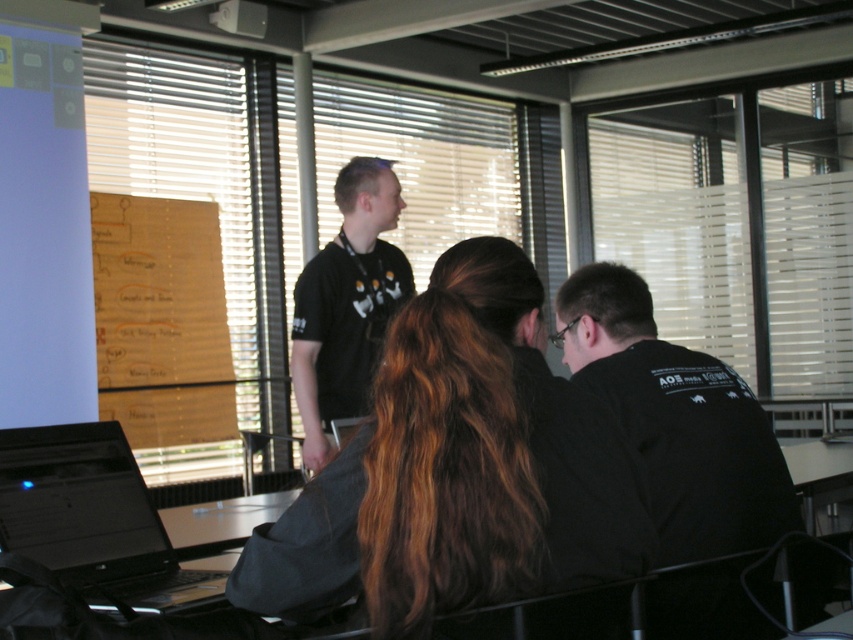
Describe the element at coordinates (347, 304) in the screenshot. I see `black matte shirt at center` at that location.

Is black matte shirt at center behind white plastic projector at upper center?

That is False.

Who is more distant from viewer, (326,397) or (233,12)?

Positioned behind is point (233,12).

The height and width of the screenshot is (640, 853). Find the location of `black matte shirt at center`. black matte shirt at center is located at coordinates (347, 304).

Which is behind, point (775, 593) or point (352, 172)?

Positioned behind is point (352, 172).

Which of these two, black matte shirt at right or black matte shirt at center, stands taller?

black matte shirt at center

Does point (659, 486) lie behind point (325, 336)?

That is False.

The height and width of the screenshot is (640, 853). I want to click on black matte shirt at right, so click(x=676, y=420).

Can you confirm if black matte shirt at right is thinner than matte white projector screen at upper left?

No, black matte shirt at right is not thinner than matte white projector screen at upper left.

Measure the distance from black matte shirt at right to matte white projector screen at upper left.

A distance of 3.30 meters exists between black matte shirt at right and matte white projector screen at upper left.

Which is behind, point (675, 376) or point (47, 220)?

The point (47, 220) is more distant.

The image size is (853, 640). I want to click on black matte shirt at right, so click(x=676, y=420).